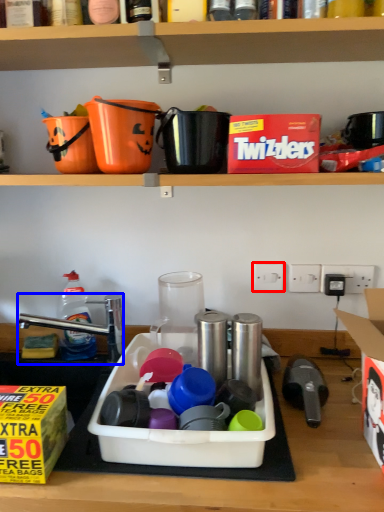
Question: Which object appears farthest to the camera in this image, electric outlet (highlighted by a red box) or faucet (highlighted by a blue box)?

Choices:
 (A) electric outlet
 (B) faucet

Answer: (A)